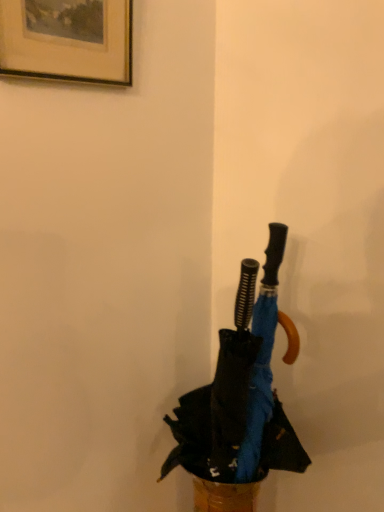
Question: Considering the positions of brushed metal picture frame at upper left and blue fabric umbrella at center in the image, is brushed metal picture frame at upper left taller or shorter than blue fabric umbrella at center?

Choices:
 (A) short
 (B) tall

Answer: (A)

Question: Choose the correct answer: Is brushed metal picture frame at upper left inside blue fabric umbrella at center or outside it?

Choices:
 (A) inside
 (B) outside

Answer: (B)

Question: Is point (34, 53) positioned closer to the camera than point (215, 436)?

Choices:
 (A) closer
 (B) farther

Answer: (A)

Question: From the image's perspective, is blue fabric umbrella at center above or below brushed metal picture frame at upper left?

Choices:
 (A) above
 (B) below

Answer: (B)

Question: From a real-world perspective, is blue fabric umbrella at center positioned above or below brushed metal picture frame at upper left?

Choices:
 (A) below
 (B) above

Answer: (A)

Question: Would you say blue fabric umbrella at center is to the left or to the right of brushed metal picture frame at upper left in the picture?

Choices:
 (A) right
 (B) left

Answer: (A)

Question: Is blue fabric umbrella at center wider or thinner than brushed metal picture frame at upper left?

Choices:
 (A) wide
 (B) thin

Answer: (A)